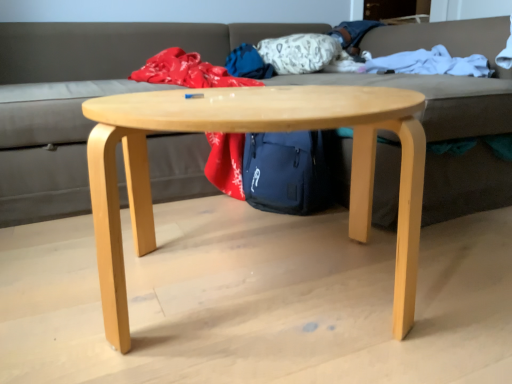
Question: Is the depth of white soft blanket at upper right less than that of gray fabric couch at center?

Choices:
 (A) no
 (B) yes

Answer: (A)

Question: Is white soft blanket at upper right positioned beyond the bounds of gray fabric couch at center?

Choices:
 (A) yes
 (B) no

Answer: (B)

Question: From the image's perspective, is white soft blanket at upper right on gray fabric couch at center?

Choices:
 (A) no
 (B) yes

Answer: (B)

Question: From a real-world perspective, is white soft blanket at upper right physically below gray fabric couch at center?

Choices:
 (A) no
 (B) yes

Answer: (A)

Question: Is white soft blanket at upper right at the right side of gray fabric couch at center?

Choices:
 (A) no
 (B) yes

Answer: (B)

Question: From a real-world perspective, does white soft blanket at upper right stand above gray fabric couch at center?

Choices:
 (A) yes
 (B) no

Answer: (A)

Question: From a real-world perspective, is white soft blanket at upper right below natural wood coffee table at center?

Choices:
 (A) no
 (B) yes

Answer: (A)

Question: Considering the relative sizes of white soft blanket at upper right and natural wood coffee table at center in the image provided, is white soft blanket at upper right shorter than natural wood coffee table at center?

Choices:
 (A) no
 (B) yes

Answer: (B)

Question: Is white soft blanket at upper right placed right next to natural wood coffee table at center?

Choices:
 (A) yes
 (B) no

Answer: (B)

Question: Is white soft blanket at upper right smaller than natural wood coffee table at center?

Choices:
 (A) no
 (B) yes

Answer: (B)

Question: Is white soft blanket at upper right located outside natural wood coffee table at center?

Choices:
 (A) yes
 (B) no

Answer: (A)

Question: From a real-world perspective, is white soft blanket at upper right located higher than natural wood coffee table at center?

Choices:
 (A) no
 (B) yes

Answer: (B)

Question: Would you say natural wood coffee table at center is a long distance from gray fabric couch at center?

Choices:
 (A) no
 (B) yes

Answer: (B)